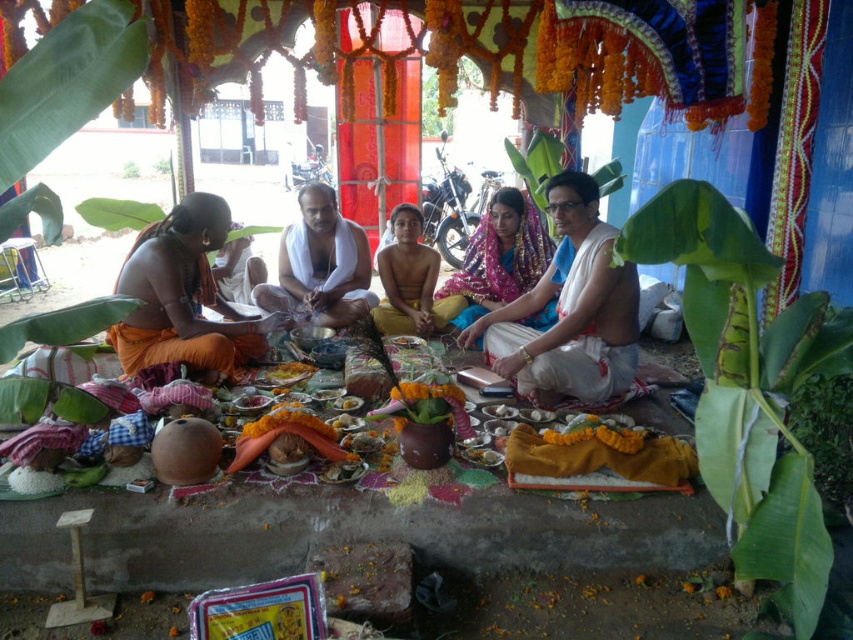
You are a photographer standing at the edge of the gathering. You want to take a photo that includes both the white clothed man at center and the brown skin child at center. The camera you have can capture a maximum distance of 30 centimeters between subjects. Will you be able to capture both in one frame?

The white clothed man at center is 32.51 centimeters from the brown skin child at center. Since the camera can only capture up to 30 centimeters between subjects, you will not be able to capture both in one frame.

You are standing at the center of the gathering and want to reach both the point at coordinates point (339, 212) and point (426, 305). Which point is closer to you?

Point (339, 212) is closer to you because it is further to the camera than point (426, 305), meaning it is nearer in the scene.